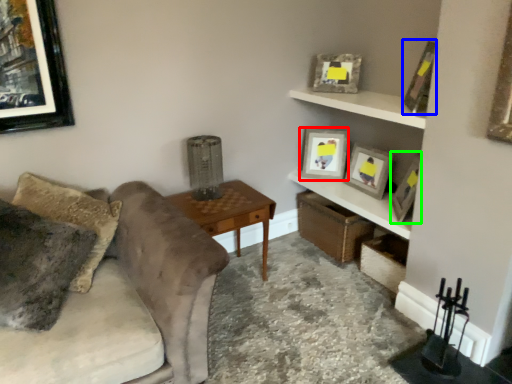
Question: Considering the real-world distances, which object is farthest from picture frame (highlighted by a red box)? picture frame (highlighted by a blue box) or picture frame (highlighted by a green box)?

Choices:
 (A) picture frame
 (B) picture frame

Answer: (A)